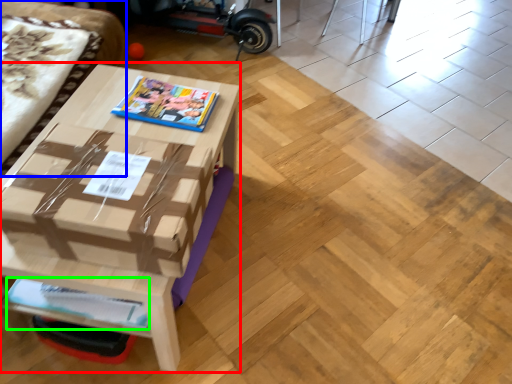
Question: Which object is the farthest from table (highlighted by a red box)? Choose among these: couch (highlighted by a blue box) or magazine (highlighted by a green box).

Choices:
 (A) couch
 (B) magazine

Answer: (A)